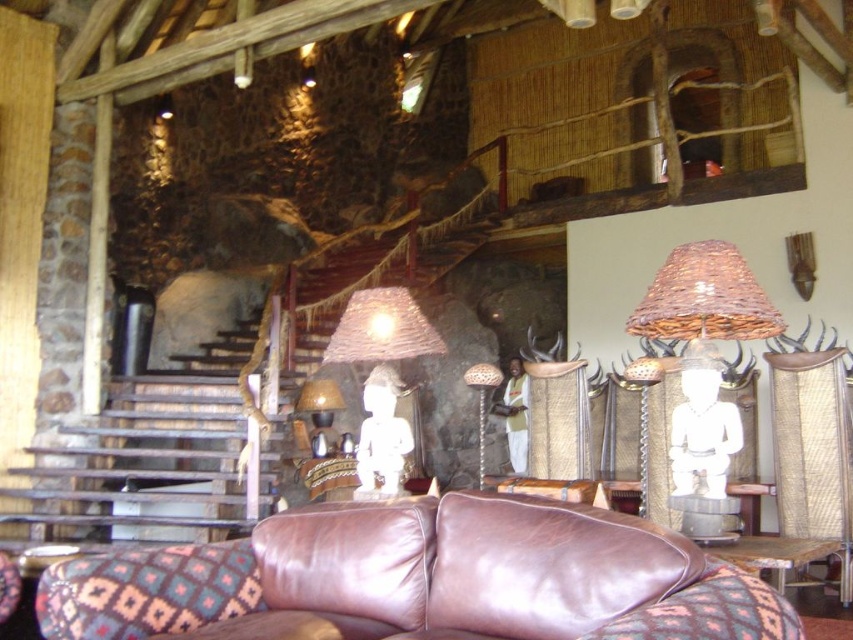
Question: Among these points, which one is farthest from the camera?

Choices:
 (A) (508, 570)
 (B) (312, 397)

Answer: (B)

Question: Where is woven straw lampshade at center located in relation to matte wicker lampshade at center in the image?

Choices:
 (A) below
 (B) above

Answer: (B)

Question: Considering the relative positions of brown leather couch at lower center and matte wicker lampshade at center in the image provided, where is brown leather couch at lower center located with respect to matte wicker lampshade at center?

Choices:
 (A) above
 (B) below

Answer: (A)

Question: Which point appears farthest from the camera in this image?

Choices:
 (A) (392, 534)
 (B) (326, 404)
 (C) (395, 310)

Answer: (B)

Question: Is woven straw lampshade at center to the right of matte wicker lampshade at center from the viewer's perspective?

Choices:
 (A) no
 (B) yes

Answer: (B)

Question: Which point is farther to the camera?

Choices:
 (A) matte wicker lampshade at center
 (B) woven straw lampshade at center
 (C) brown leather couch at lower center

Answer: (A)